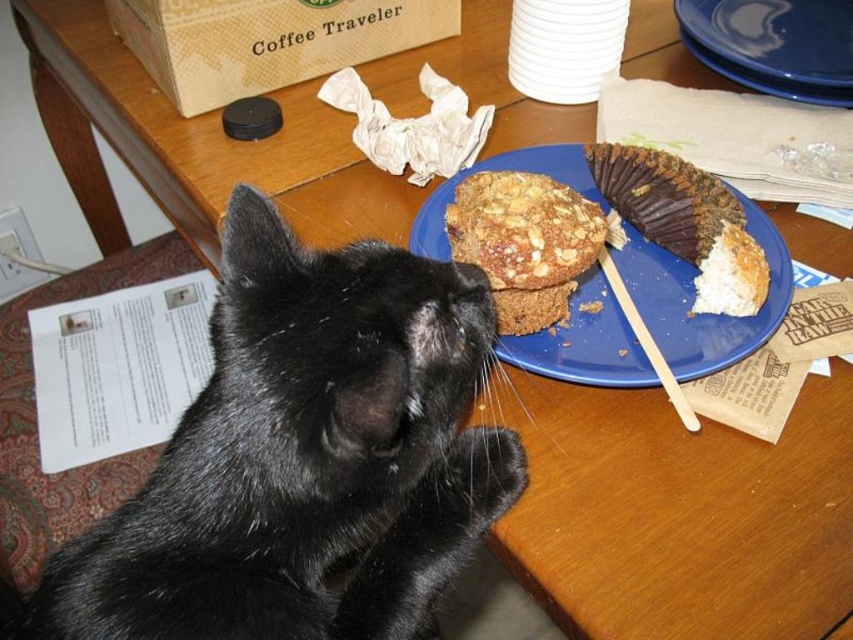
Question: Does black fur cat at lower left come in front of blue ceramic plate at upper center?

Choices:
 (A) no
 (B) yes

Answer: (B)

Question: Which point is closer to the camera?

Choices:
 (A) (531, 321)
 (B) (825, 52)
 (C) (556, 154)
 (D) (126, 593)

Answer: (D)

Question: Which point appears farthest from the camera in this image?

Choices:
 (A) (630, 262)
 (B) (463, 468)

Answer: (A)

Question: Can you confirm if blue matte plate at upper right is bigger than golden brown crumbly muffin at center?

Choices:
 (A) no
 (B) yes

Answer: (B)

Question: Does golden brown crumbly muffin at center have a smaller size compared to blue ceramic plate at upper center?

Choices:
 (A) yes
 (B) no

Answer: (A)

Question: Which object is the closest to the golden brown crumbly muffin at center?

Choices:
 (A) blue ceramic plate at upper center
 (B) blue matte plate at upper right

Answer: (B)